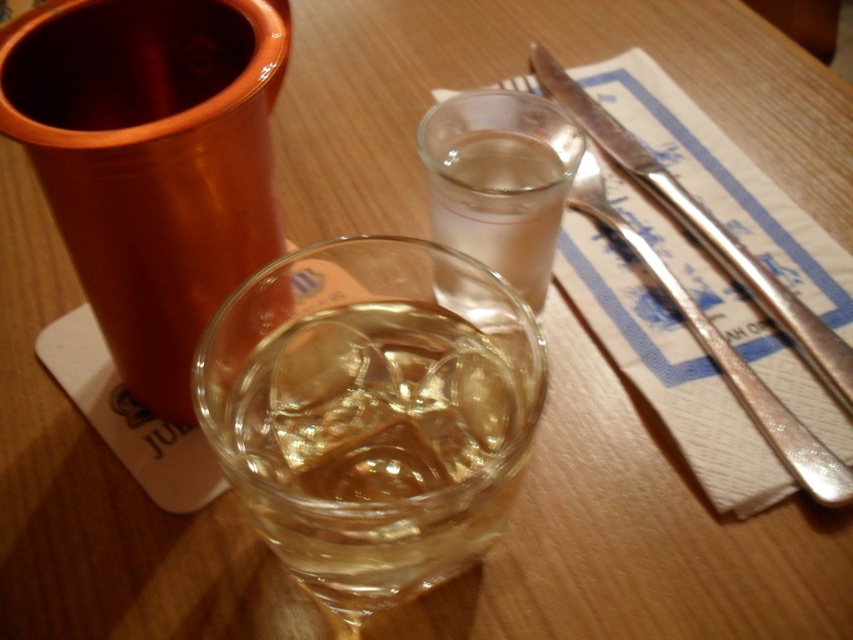
Based on the photo, you are a server at a restaurant and need to place a dessert plate between the transparent glass at center and the polished metal knife at upper right. Which object should you move to make space?

The transparent glass at center has a smaller width than the polished metal knife at upper right, so you should move the transparent glass at center to make space for the dessert plate.

You are a server at a restaurant and need to determine which item is more suitable for holding a hot beverage. Based on the scene, which object is thicker and thus better insulated? Please choose between the clear glass at upper center and the polished metal knife at upper right.

The polished metal knife at upper right is thicker than the clear glass at upper center, making it better insulated for holding a hot beverage.

What is located at the coordinates point (372, 412)?

The transparent glass at center is located at point (372, 412).